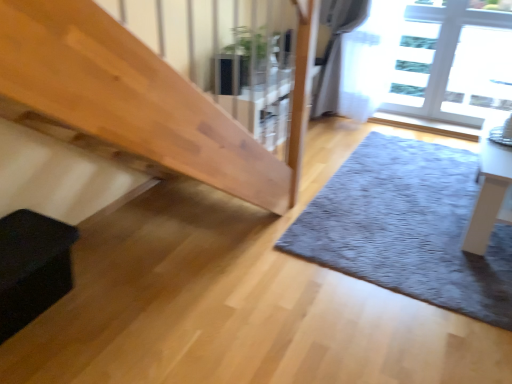
Question: Considering the relative sizes of black matte box at lower left and white glossy table at right in the image provided, is black matte box at lower left smaller than white glossy table at right?

Choices:
 (A) no
 (B) yes

Answer: (B)

Question: From a real-world perspective, is black matte box at lower left physically below white glossy table at right?

Choices:
 (A) yes
 (B) no

Answer: (A)

Question: Does black matte box at lower left appear on the right side of white glossy table at right?

Choices:
 (A) yes
 (B) no

Answer: (B)

Question: Can you confirm if black matte box at lower left is wider than white glossy table at right?

Choices:
 (A) yes
 (B) no

Answer: (A)

Question: From the image's perspective, is black matte box at lower left above white glossy table at right?

Choices:
 (A) yes
 (B) no

Answer: (B)

Question: Considering the relative sizes of black matte box at lower left and white glossy table at right in the image provided, is black matte box at lower left taller than white glossy table at right?

Choices:
 (A) no
 (B) yes

Answer: (A)

Question: Could black matte box at lower left be considered to be inside gray shaggy rug at lower right?

Choices:
 (A) no
 (B) yes

Answer: (A)

Question: Does gray shaggy rug at lower right come behind black matte box at lower left?

Choices:
 (A) no
 (B) yes

Answer: (B)

Question: Is gray shaggy rug at lower right in front of black matte box at lower left?

Choices:
 (A) yes
 (B) no

Answer: (B)

Question: From a real-world perspective, is gray shaggy rug at lower right below black matte box at lower left?

Choices:
 (A) yes
 (B) no

Answer: (A)

Question: Is gray shaggy rug at lower right not inside black matte box at lower left?

Choices:
 (A) no
 (B) yes

Answer: (B)

Question: From the image's perspective, is gray shaggy rug at lower right over black matte box at lower left?

Choices:
 (A) no
 (B) yes

Answer: (B)

Question: Is green glossy plant at upper center at the back of transparent glass window at upper right?

Choices:
 (A) no
 (B) yes

Answer: (A)